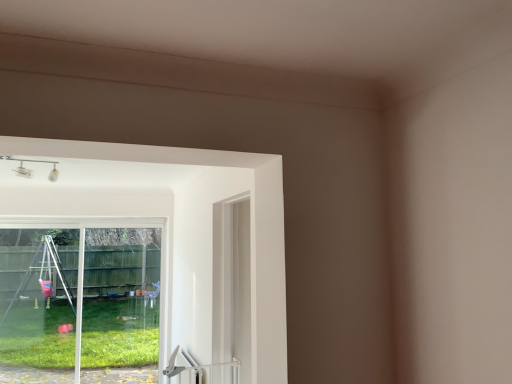
Question: In terms of height, does transparent glass window at lower left look taller or shorter compared to white plastic door handle at lower center?

Choices:
 (A) short
 (B) tall

Answer: (B)

Question: Is transparent glass window at lower left inside or outside of white plastic door handle at lower center?

Choices:
 (A) inside
 (B) outside

Answer: (B)

Question: In the image, is transparent glass window at lower left positioned in front of or behind white plastic door handle at lower center?

Choices:
 (A) behind
 (B) front

Answer: (A)

Question: In terms of width, does white plastic door handle at lower center look wider or thinner when compared to transparent glass window at lower left?

Choices:
 (A) thin
 (B) wide

Answer: (B)

Question: Choose the correct answer: Is white plastic door handle at lower center inside transparent glass window at lower left or outside it?

Choices:
 (A) inside
 (B) outside

Answer: (B)

Question: Relative to transparent glass window at lower left, is white plastic door handle at lower center in front or behind?

Choices:
 (A) front
 (B) behind

Answer: (A)

Question: From a real-world perspective, is white plastic door handle at lower center physically located above or below transparent glass window at lower left?

Choices:
 (A) above
 (B) below

Answer: (B)